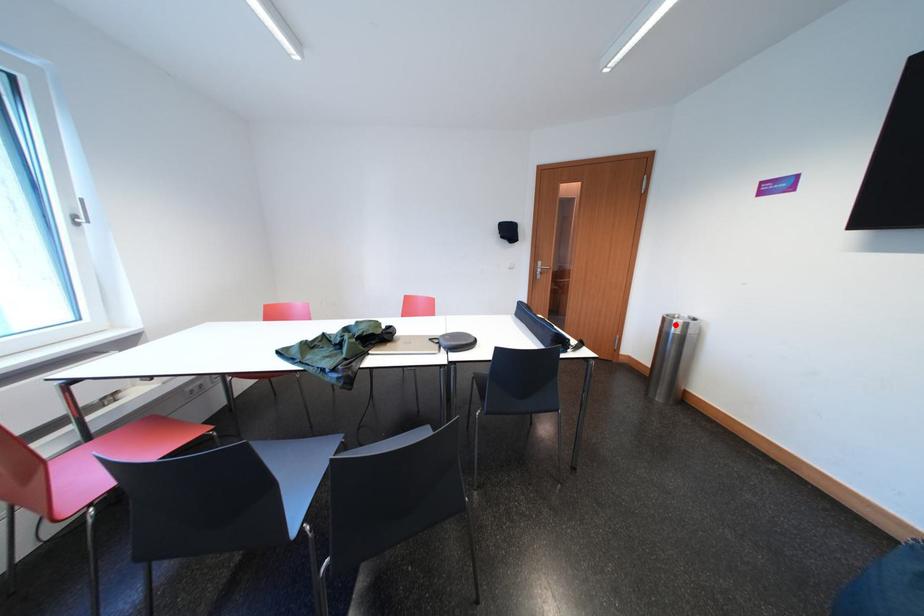
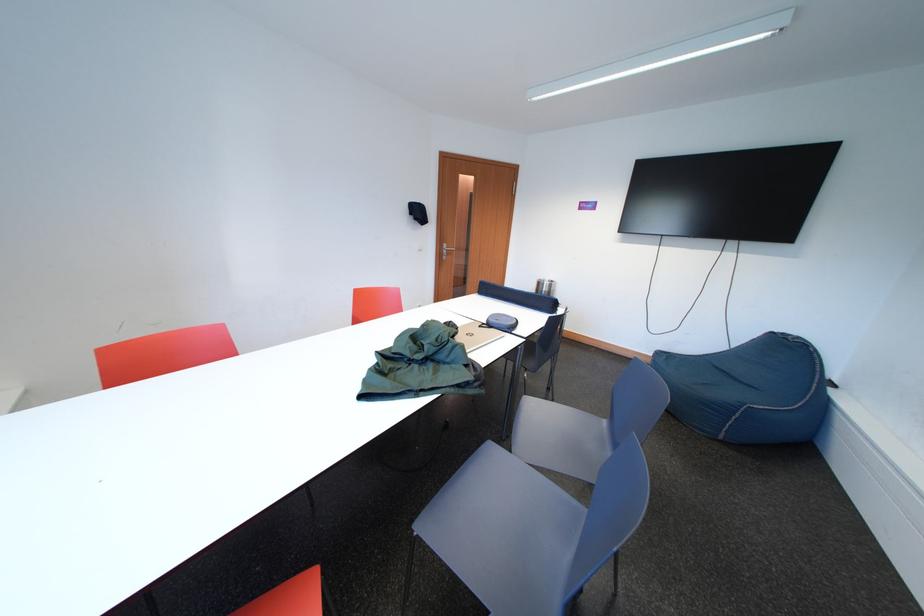
Where in the second image is the point corresponding to the highlighted location from the first image?

(549, 288)